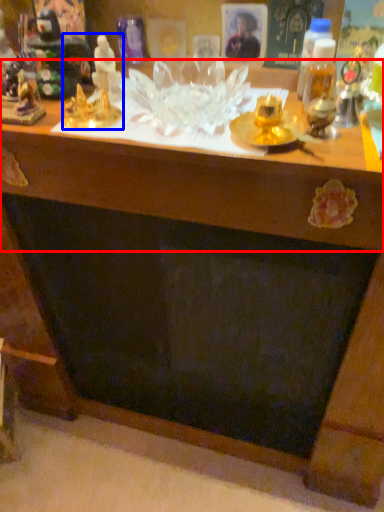
Question: Which object is further to the camera taking this photo, table (highlighted by a red box) or toy (highlighted by a blue box)?

Choices:
 (A) table
 (B) toy

Answer: (B)